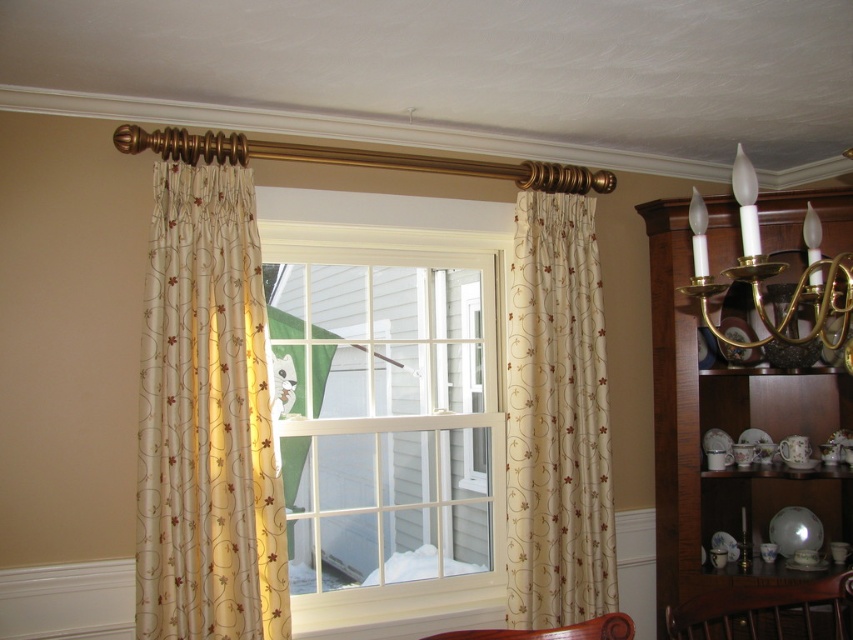
Does white glass window at center have a lesser width compared to mahogany wood chair at lower right?

Incorrect, white glass window at center's width is not less than mahogany wood chair at lower right's.

Describe the element at coordinates (389, 424) in the screenshot. I see `white glass window at center` at that location.

The image size is (853, 640). I want to click on white glass window at center, so click(389, 424).

Who is taller, beige floral fabric curtain at right or brown wood chair at lower center?

With more height is beige floral fabric curtain at right.

Can you confirm if beige floral fabric curtain at right is thinner than brown wood chair at lower center?

Correct, beige floral fabric curtain at right's width is less than brown wood chair at lower center's.

Is point (531, 308) in front of point (624, 637)?

No, (531, 308) is behind (624, 637).

Where is `beige floral fabric curtain at right`? The width and height of the screenshot is (853, 640). beige floral fabric curtain at right is located at coordinates (556, 419).

Which is below, beige floral fabric curtain at right or mahogany wood chair at lower right?

mahogany wood chair at lower right

Where is `beige floral fabric curtain at right`? This screenshot has height=640, width=853. beige floral fabric curtain at right is located at coordinates click(x=556, y=419).

Find the location of `beige floral fabric curtain at right`. beige floral fabric curtain at right is located at coordinates (556, 419).

I want to click on beige floral fabric curtain at right, so (556, 419).